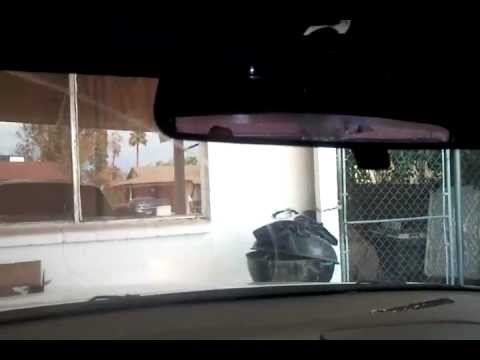
Identify the location of cover. (306, 239).